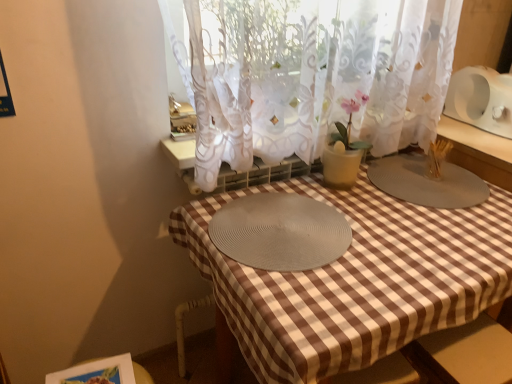
Question: Considering the relative positions of gray woven placemat at center, positioned as the 1th glass plate in left-to-right order, and white sheer curtain at center in the image provided, is gray woven placemat at center, positioned as the 1th glass plate in left-to-right order, in front of white sheer curtain at center?

Choices:
 (A) no
 (B) yes

Answer: (A)

Question: Considering the relative sizes of gray woven placemat at center, placed as the second glass plate when sorted from right to left, and white sheer curtain at center in the image provided, is gray woven placemat at center, placed as the second glass plate when sorted from right to left, shorter than white sheer curtain at center?

Choices:
 (A) no
 (B) yes

Answer: (B)

Question: Can you confirm if gray woven placemat at center, positioned as the 1th glass plate in left-to-right order, is wider than white sheer curtain at center?

Choices:
 (A) no
 (B) yes

Answer: (B)

Question: Does gray woven placemat at center, placed as the second glass plate when sorted from right to left, have a larger size compared to white sheer curtain at center?

Choices:
 (A) yes
 (B) no

Answer: (B)

Question: Is gray woven placemat at center, positioned as the 1th glass plate in left-to-right order, positioned beyond the bounds of white sheer curtain at center?

Choices:
 (A) yes
 (B) no

Answer: (A)

Question: From a real-world perspective, is gray matte placemat at center, the first glass plate positioned from the right, positioned above or below white sheer curtain at center?

Choices:
 (A) above
 (B) below

Answer: (B)

Question: In terms of height, does gray matte placemat at center, which ranks as the second glass plate in left-to-right order, look taller or shorter compared to white sheer curtain at center?

Choices:
 (A) tall
 (B) short

Answer: (B)

Question: From the image's perspective, relative to white sheer curtain at center, is gray matte placemat at center, which ranks as the second glass plate in left-to-right order, above or below?

Choices:
 (A) below
 (B) above

Answer: (A)

Question: In terms of size, does gray matte placemat at center, which ranks as the second glass plate in left-to-right order, appear bigger or smaller than white sheer curtain at center?

Choices:
 (A) big
 (B) small

Answer: (B)

Question: In terms of height, does white sheer curtain at center look taller or shorter compared to gray woven placemat at center, placed as the second glass plate when sorted from right to left?

Choices:
 (A) short
 (B) tall

Answer: (B)

Question: In terms of size, does white sheer curtain at center appear bigger or smaller than gray woven placemat at center, placed as the second glass plate when sorted from right to left?

Choices:
 (A) big
 (B) small

Answer: (A)

Question: Relative to gray woven placemat at center, placed as the second glass plate when sorted from right to left, is white sheer curtain at center in front or behind?

Choices:
 (A) behind
 (B) front

Answer: (B)

Question: From a real-world perspective, is white sheer curtain at center above or below gray woven placemat at center, placed as the second glass plate when sorted from right to left?

Choices:
 (A) below
 (B) above

Answer: (B)

Question: Relative to white sheer curtain at center, is gray woven placemat at center, placed as the second glass plate when sorted from right to left, in front or behind?

Choices:
 (A) front
 (B) behind

Answer: (B)

Question: Looking at their shapes, would you say gray woven placemat at center, placed as the second glass plate when sorted from right to left, is wider or thinner than white sheer curtain at center?

Choices:
 (A) thin
 (B) wide

Answer: (B)